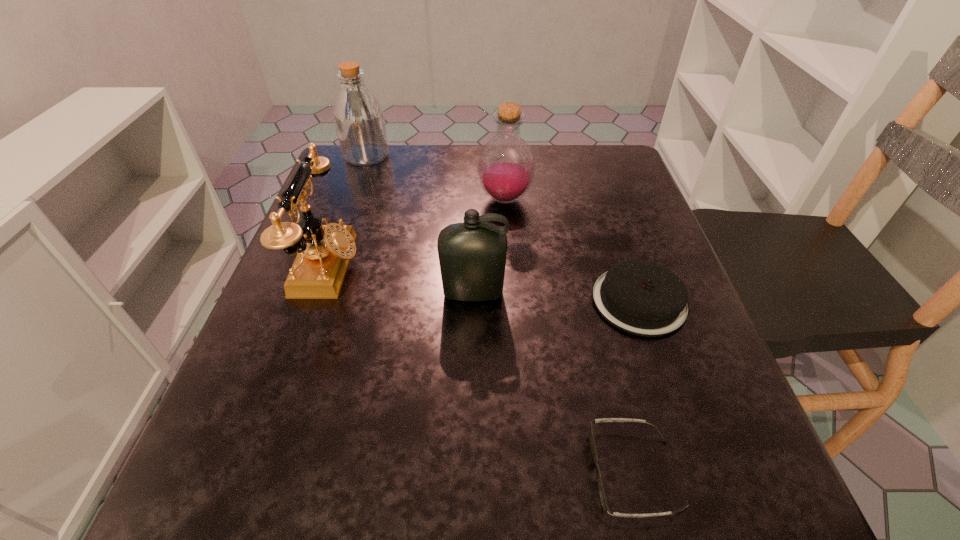
You are a GUI agent. You are given a task and a screenshot of the screen. Output one action in this format:
    pyautogui.click(x=<x>, y=<y>)
    Task: Click on the sunglasses situated at the right edge
    The image size is (960, 540).
    Given the screenshot: What is the action you would take?
    pyautogui.click(x=604, y=504)

You are a GUI agent. You are given a task and a screenshot of the screen. Output one action in this format:
    pyautogui.click(x=<x>, y=<y>)
    Task: Click on the object positioned at the far left corner
    
    Given the screenshot: What is the action you would take?
    pyautogui.click(x=358, y=116)

Locate an element on the screen. This screenshot has height=540, width=960. object that is at the near right corner is located at coordinates (604, 504).

This screenshot has height=540, width=960. What are the coordinates of `free region at the far edge` in the screenshot? It's located at (461, 170).

Identify the location of vacant space at the near edge of the desktop. The width and height of the screenshot is (960, 540). (450, 496).

Image resolution: width=960 pixels, height=540 pixels. I want to click on vacant region at the left edge, so click(258, 390).

Where is `free point at the right edge`? The height and width of the screenshot is (540, 960). free point at the right edge is located at coordinates (x=604, y=239).

Image resolution: width=960 pixels, height=540 pixels. What are the coordinates of `free point at the far left corner` in the screenshot? It's located at (370, 190).

Where is `blank space at the far right corner`? The height and width of the screenshot is (540, 960). blank space at the far right corner is located at coordinates (626, 191).

Identify the location of free spot at the near right corner of the desktop. (663, 502).